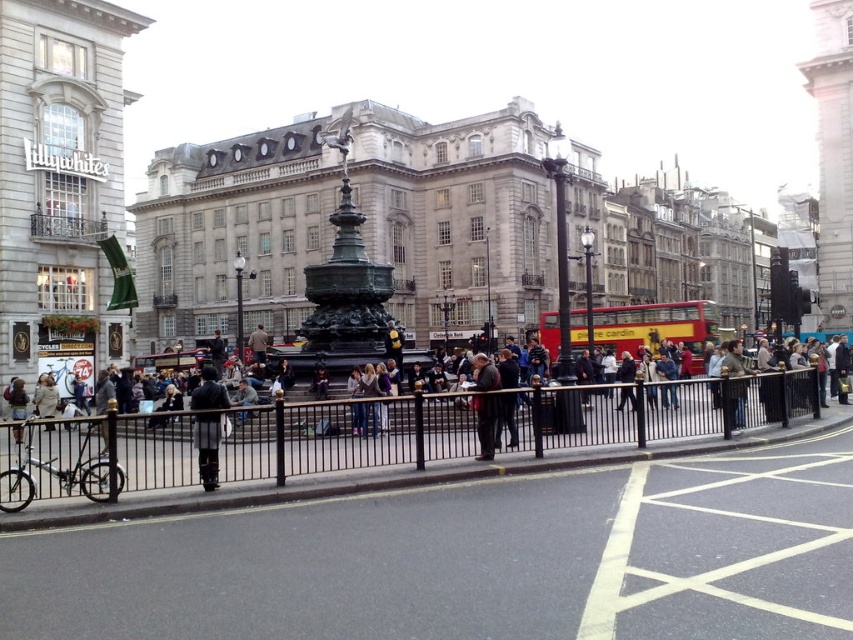
You are standing in the plaza and want to place a new bench exactly 50 meters away from your current position. The point marked at coordinates (281, 435) is in your view. Is this point far enough to place the bench?

The point marked at coordinates (281, 435) is 44.28 meters from the viewer, which is closer than the required 50 meters. Therefore, this point is not far enough to place the bench.